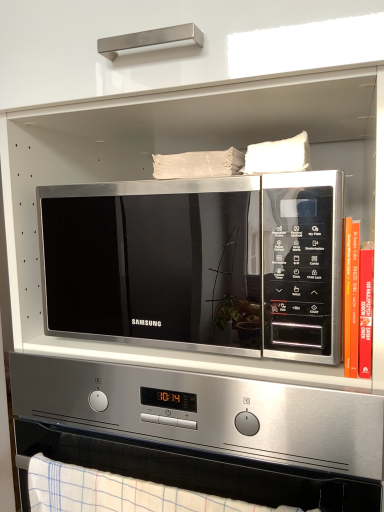
Question: Can you confirm if satin silver microwave at center is wider than hardcover book at right?

Choices:
 (A) no
 (B) yes

Answer: (B)

Question: Considering the relative positions of satin silver microwave at center and hardcover book at right in the image provided, is satin silver microwave at center behind hardcover book at right?

Choices:
 (A) no
 (B) yes

Answer: (A)

Question: From a real-world perspective, is satin silver microwave at center positioned under hardcover book at right based on gravity?

Choices:
 (A) no
 (B) yes

Answer: (B)

Question: Is the position of satin silver microwave at center less distant than that of hardcover book at right?

Choices:
 (A) no
 (B) yes

Answer: (B)

Question: Can you confirm if satin silver microwave at center is thinner than hardcover book at right?

Choices:
 (A) yes
 (B) no

Answer: (B)

Question: Is satin silver microwave at center not within hardcover book at right?

Choices:
 (A) yes
 (B) no

Answer: (A)

Question: Can you confirm if satin silver microwave at center is wider than hardcover book at right?

Choices:
 (A) yes
 (B) no

Answer: (A)

Question: Does satin silver microwave at center contain hardcover book at right?

Choices:
 (A) yes
 (B) no

Answer: (B)

Question: From a real-world perspective, is satin silver microwave at center under hardcover book at right?

Choices:
 (A) yes
 (B) no

Answer: (B)

Question: From a real-world perspective, is satin silver microwave at center located higher than hardcover book at right?

Choices:
 (A) no
 (B) yes

Answer: (B)

Question: Is satin silver microwave at center to the right of hardcover book at right from the viewer's perspective?

Choices:
 (A) no
 (B) yes

Answer: (A)

Question: From the image's perspective, is satin silver microwave at center on hardcover book at right?

Choices:
 (A) yes
 (B) no

Answer: (A)

Question: Is satin silver microwave at center closer to camera compared to white checkered towel at lower center?

Choices:
 (A) no
 (B) yes

Answer: (A)